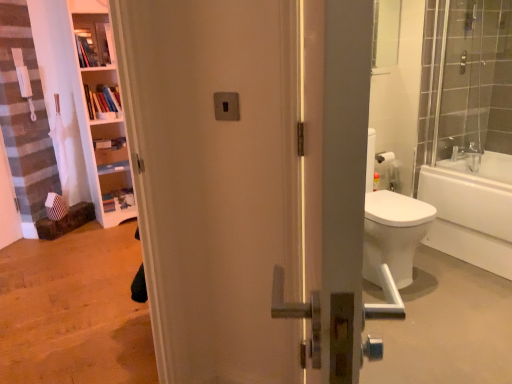
Question: In the image, is clear glass shower door at right on the left side or the right side of white glossy bathtub at right?

Choices:
 (A) right
 (B) left

Answer: (B)

Question: From their relative heights in the image, would you say clear glass shower door at right is taller or shorter than white glossy bathtub at right?

Choices:
 (A) short
 (B) tall

Answer: (B)

Question: Estimate the real-world distances between objects in this image. Which object is closer to the wooden bookshelf at upper left, placed as the second shelf when sorted from top to bottom?

Choices:
 (A) wooden shelves at upper left, positioned as the first shelf in top-to-bottom order
 (B) clear glass shower door at right
 (C) white glossy bathtub at right

Answer: (A)

Question: Which object is the closest to the clear glass shower door at right?

Choices:
 (A) wooden shelves at upper left, positioned as the first shelf in top-to-bottom order
 (B) wooden bookshelf at upper left, the first shelf from the bottom
 (C) white glossy bathtub at right

Answer: (C)